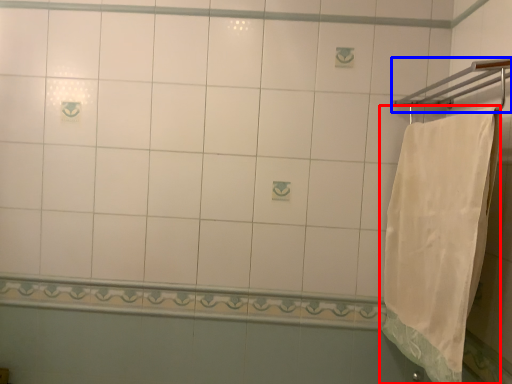
Question: Which object is further to the camera taking this photo, towel (highlighted by a red box) or towel bar (highlighted by a blue box)?

Choices:
 (A) towel
 (B) towel bar

Answer: (A)